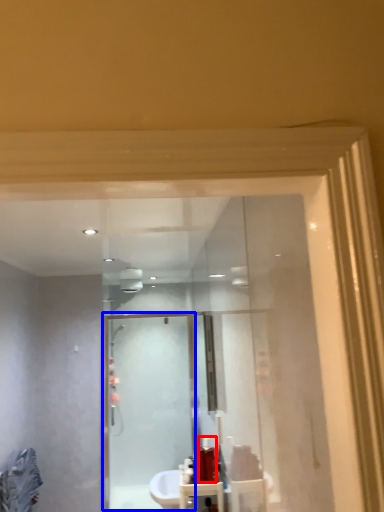
Question: Which of the following is the farthest to the observer, toiletry (highlighted by a red box) or screen door (highlighted by a blue box)?

Choices:
 (A) toiletry
 (B) screen door

Answer: (B)